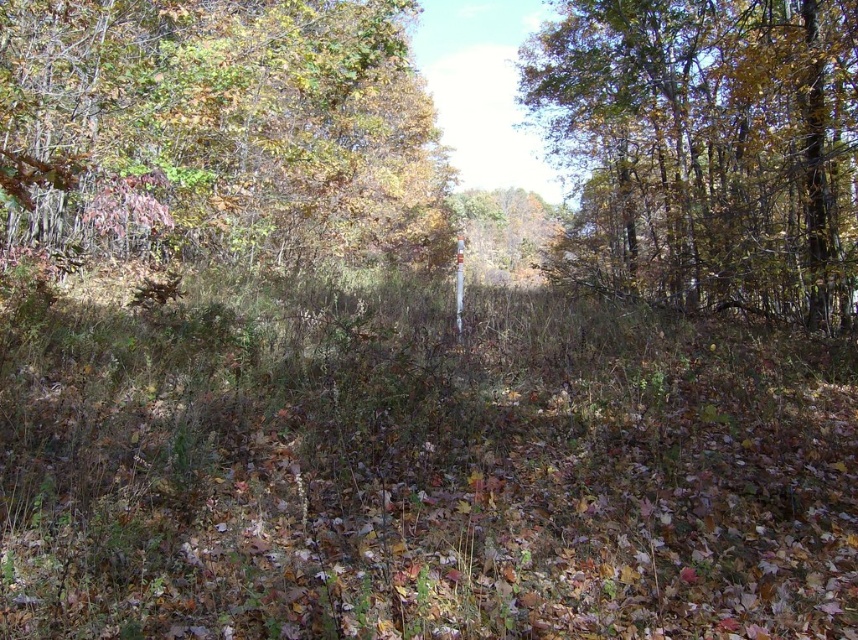
Based on the photo, you are standing in the autumn woods and see a point marked at coordinates (x=221, y=129). Based on the scene description, which object does this point belong to?

The point at coordinates (x=221, y=129) is on the green leafy tree at upper left.

You are standing at the center of the path in the middle ground of the wooded area. Which direction should you look to see the green leafy tree at upper left?

The green leafy tree at upper left is located at point (x=221, y=129), so you should look towards the upper left direction to see it.